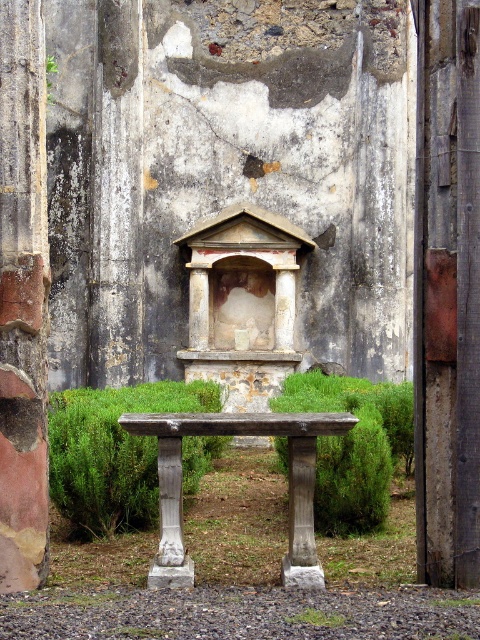
You are planning to place a new sculpture that requires a stable base. Given the rustic stone column at left and the wooden table at center, which object would be more suitable for supporting heavy items based on their size?

The wooden table at center is more suitable for supporting heavy items because it has a larger size compared to the rustic stone column at left.

You are planning to place a new sculpture that requires a base wider than 20 cm. Based on the scene, which object between the rustic stone column at left and the wooden table at center would be suitable for placing the sculpture?

The wooden table at center is wider than the rustic stone column at left, so it would be suitable for placing the sculpture as its base width exceeds 20 cm.

You are planning to place a new sculpture that requires a base higher than 1.5 meters. Given the rustic stone column at left and the wooden table at center, which object can serve as a suitable base for the sculpture?

The wooden table at center is taller than the rustic stone column at left. Since the sculpture requires a base higher than 1.5 meters, the wooden table at center would be the suitable option if its height meets the requirement.